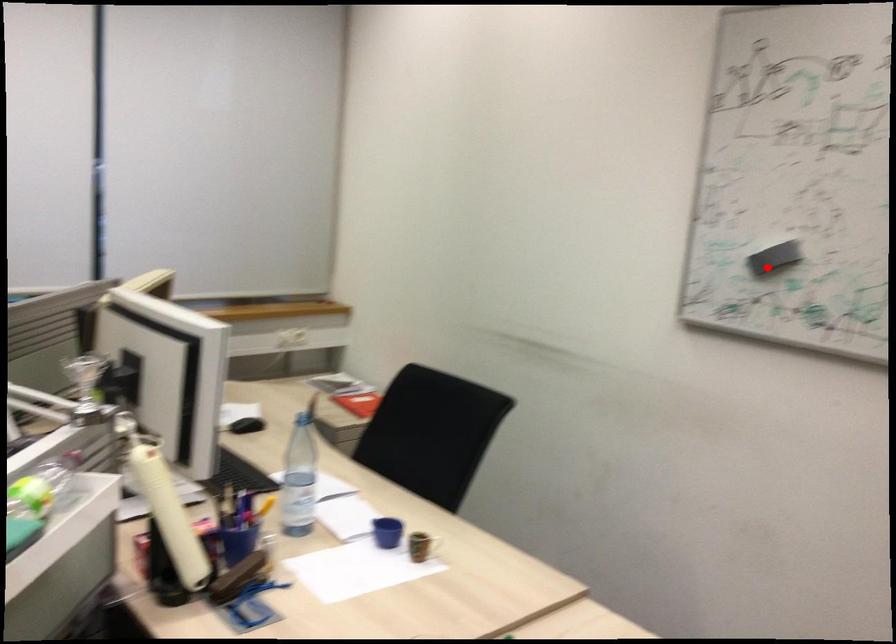
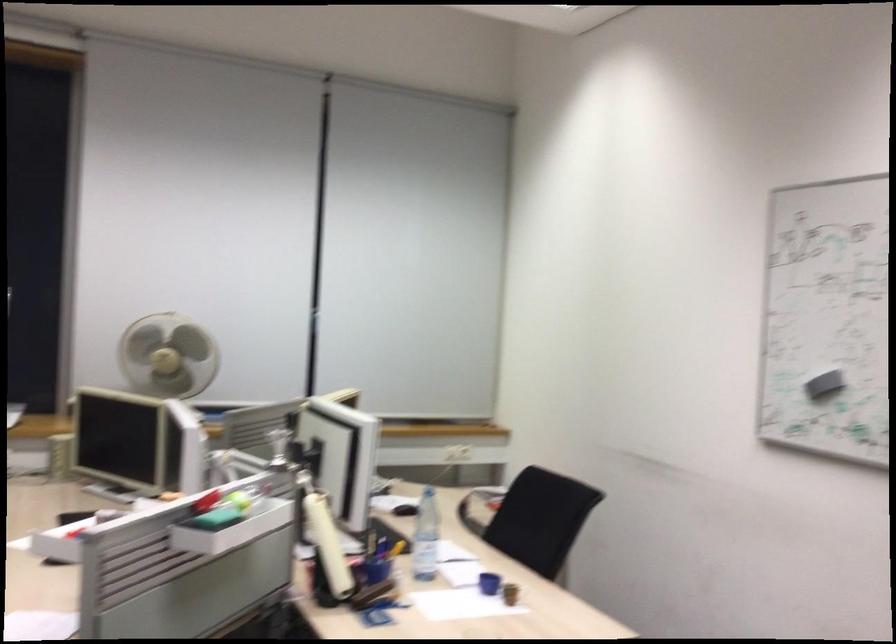
Question: I am providing you with two images of the same scene from different viewpoints. Image1 has a red point marked. In image2, the corresponding 3D location appears at what relative position? Reply with the corresponding letter.

Choices:
 (A) Closer
 (B) Farther

Answer: (B)